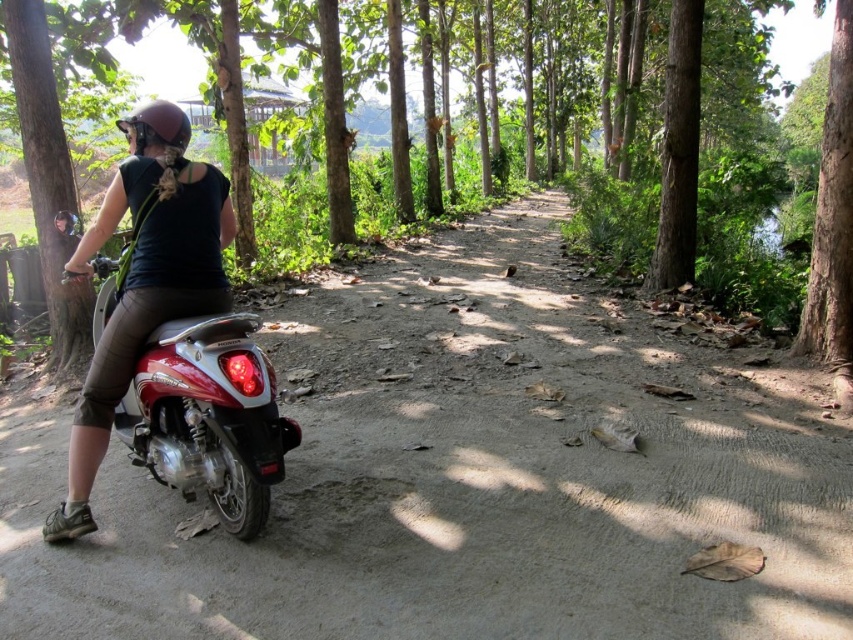
Question: Which is nearer to the brown wood tree at center?

Choices:
 (A) shiny red motorcycle at center-left
 (B) brushed metal tree at left
 (C) matte black helmet at upper left

Answer: (B)

Question: Among these objects, which one is farthest from the camera?

Choices:
 (A) brown wood tree at center
 (B) shiny red motorcycle at center-left
 (C) brushed metal tree at left

Answer: (C)

Question: Considering the real-world distances, which object is farthest from the brown matte helmet at upper left?

Choices:
 (A) brushed metal tree at left
 (B) dirt track at center
 (C) shiny red motorcycle at center-left
 (D) matte black helmet at upper left

Answer: (B)

Question: Does shiny red motorcycle at center-left lie behind brown wood tree at center?

Choices:
 (A) no
 (B) yes

Answer: (A)

Question: Can you confirm if brushed metal tree at left is positioned above brown matte helmet at upper left?

Choices:
 (A) yes
 (B) no

Answer: (B)

Question: From the image, what is the correct spatial relationship of matte black helmet at upper left in relation to brushed metal tree at left?

Choices:
 (A) below
 (B) above

Answer: (A)